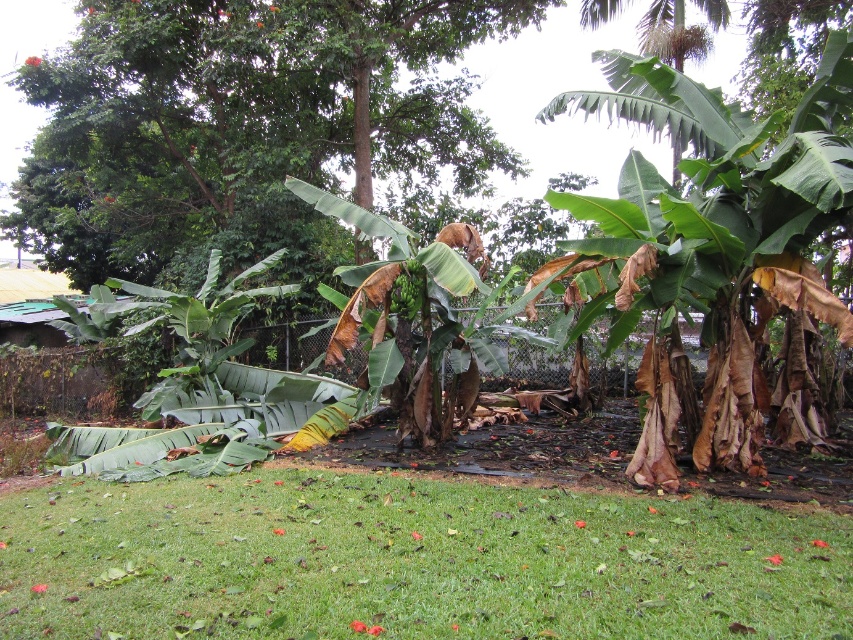
Can you confirm if green grass at lower center is positioned to the left of green leafy tree at center?

No, green grass at lower center is not to the left of green leafy tree at center.

Does green grass at lower center have a lesser width compared to green leafy tree at center?

Correct, green grass at lower center's width is less than green leafy tree at center's.

Find the location of a particular element. This screenshot has height=640, width=853. green grass at lower center is located at coordinates [x=410, y=561].

Where is `green grass at lower center`? The height and width of the screenshot is (640, 853). green grass at lower center is located at coordinates (410, 561).

Between green leafy banana tree at center and green matte bananas at center, which one is positioned lower?

green matte bananas at center is lower down.

From the picture: Can you confirm if green leafy banana tree at center is taller than green matte bananas at center?

Indeed, green leafy banana tree at center has a greater height compared to green matte bananas at center.

You are a GUI agent. You are given a task and a screenshot of the screen. Output one action in this format:
    pyautogui.click(x=<x>, y=<y>)
    Task: Click on the green leafy banana tree at center
    Image resolution: width=853 pixels, height=640 pixels.
    Given the screenshot: What is the action you would take?
    pyautogui.click(x=723, y=225)

Is green grass at lower center below green leafy banana tree at center?

Correct, green grass at lower center is located below green leafy banana tree at center.

This screenshot has width=853, height=640. Describe the element at coordinates (410, 561) in the screenshot. I see `green grass at lower center` at that location.

Find the location of a particular element. green grass at lower center is located at coordinates (410, 561).